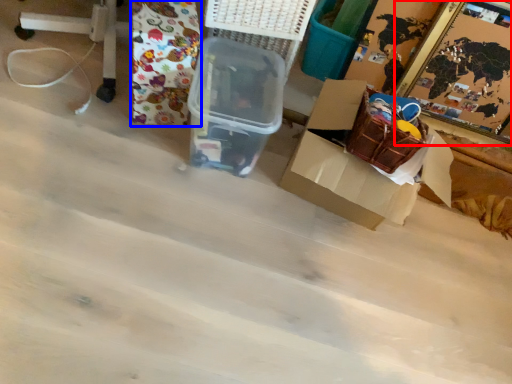
Question: Which of the following is the closest to the observer, picture frame (highlighted by a red box) or wrapping paper (highlighted by a blue box)?

Choices:
 (A) picture frame
 (B) wrapping paper

Answer: (B)